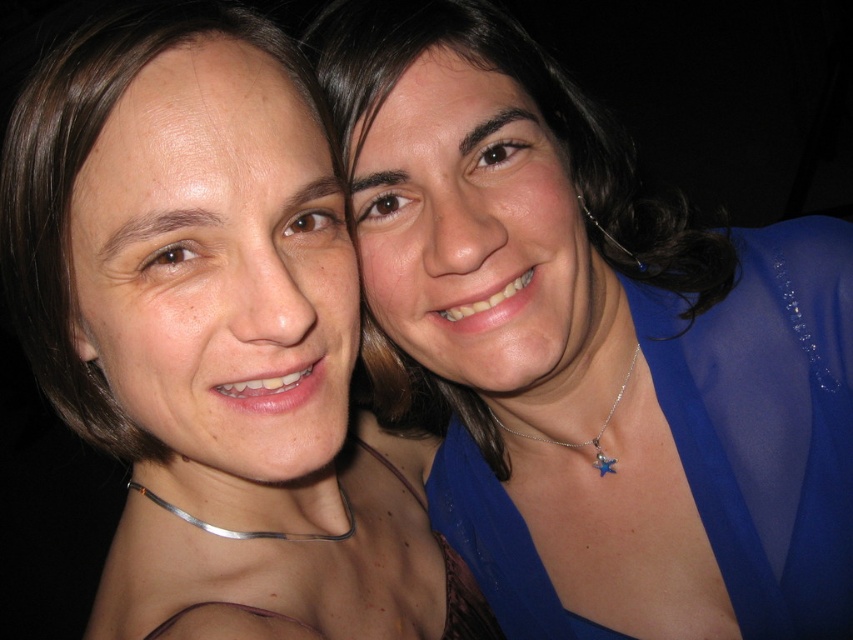
Question: Can you confirm if blue satin blouse at upper right is positioned above blue satin dress at right?

Choices:
 (A) yes
 (B) no

Answer: (A)

Question: Which of the following is the closest to the observer?

Choices:
 (A) (x=231, y=634)
 (B) (x=781, y=586)
 (C) (x=325, y=10)

Answer: (A)

Question: Is blue satin blouse at upper right wider than matte blue blouse at right?

Choices:
 (A) no
 (B) yes

Answer: (A)

Question: Which is nearer to the matte blue blouse at right?

Choices:
 (A) blue satin dress at right
 (B) blue satin blouse at upper right

Answer: (A)

Question: Where is blue satin dress at right located in relation to matte blue blouse at right in the image?

Choices:
 (A) below
 (B) above

Answer: (A)

Question: Estimate the real-world distances between objects in this image. Which object is farther from the blue satin dress at right?

Choices:
 (A) blue satin blouse at upper right
 (B) matte blue blouse at right

Answer: (A)